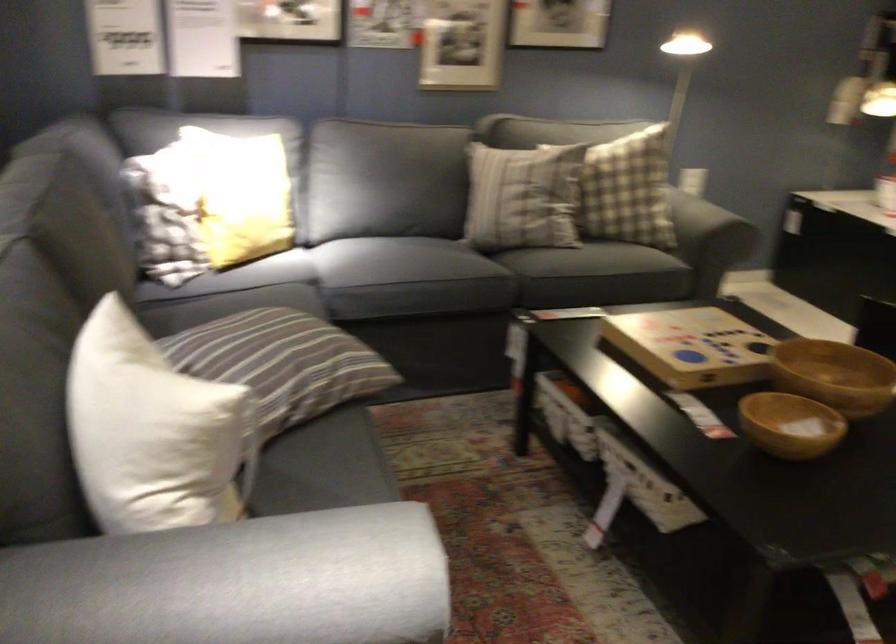
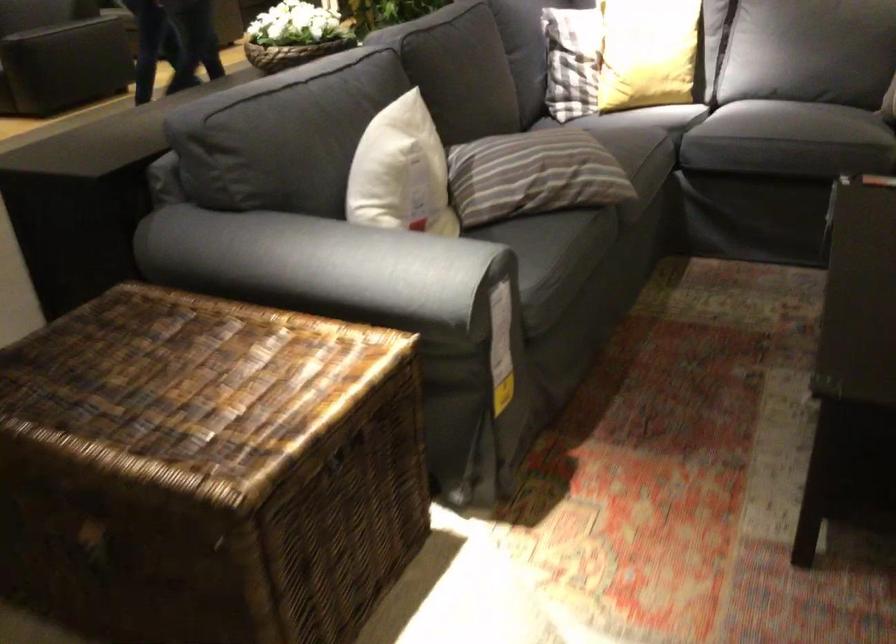
Question: The camera is either moving clockwise (left) or counter-clockwise (right) around the object. The first image is from the beginning of the video and the second image is from the end. Is the camera moving left or right when shooting the video?

Choices:
 (A) Left
 (B) Right

Answer: (B)